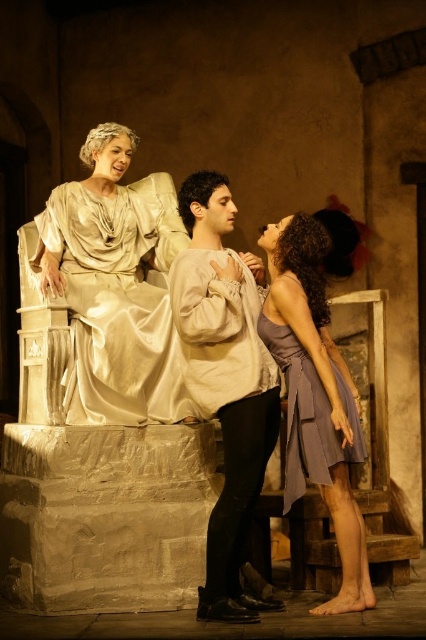
You are a stagehand looking at the image. There are two performers wearing a matte white shirt at center and a matte purple dress at center. Which performer is positioned higher in the image?

The matte white shirt at center is located above the matte purple dress at center, so the performer wearing the matte white shirt at center is positioned higher.

You are a costume designer reviewing a theatrical scene. You notice two dresses in the image. The satin dress at upper left and the matte purple dress at center. Which dress takes up more space in the scene?

The matte purple dress at center occupies more space than the satin dress at upper left.